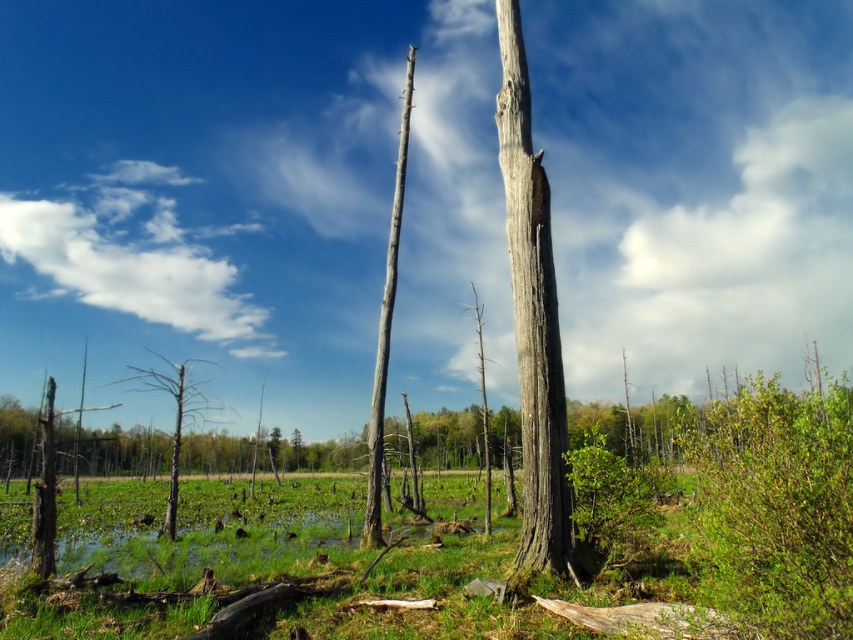
You are a bird looking for a resting spot. You see the gray bark tree at center and the brown textured tree at left. Which tree is positioned higher from the ground?

The gray bark tree at center is positioned higher from the ground than the brown textured tree at left because it is above it.